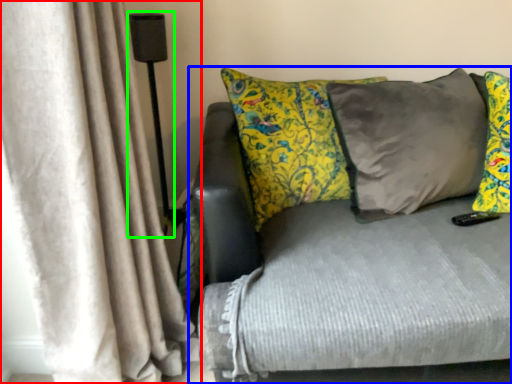
Question: Considering the real-world distances, which object is farthest from curtain (highlighted by a red box)? studio couch (highlighted by a blue box) or lamp (highlighted by a green box)?

Choices:
 (A) studio couch
 (B) lamp

Answer: (B)